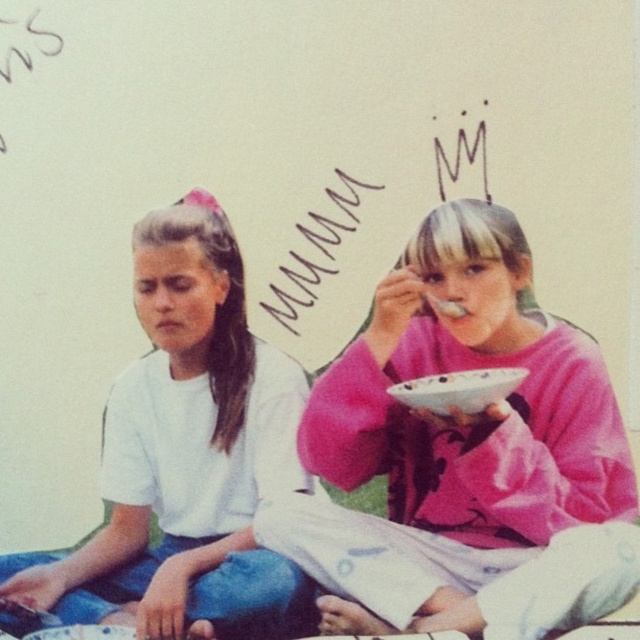
Question: Considering the relative positions of pink matte sweater at upper right and handwritten text at upper center in the image provided, where is pink matte sweater at upper right located with respect to handwritten text at upper center?

Choices:
 (A) left
 (B) right

Answer: (B)

Question: Does pink matte sweater at upper right lie in front of handwritten text at upper center?

Choices:
 (A) no
 (B) yes

Answer: (B)

Question: Which point is farther to the camera?

Choices:
 (A) pink matte sweater at upper right
 (B) white matte shirt at left
 (C) handwritten text at upper center

Answer: (C)

Question: Which is farther from the pink matte sweater at upper right?

Choices:
 (A) white matte shirt at left
 (B) handwritten text at upper center

Answer: (A)

Question: Which of the following is the farthest from the observer?

Choices:
 (A) pink matte sweater at upper right
 (B) white matte shirt at left
 (C) handwritten text at upper center

Answer: (C)

Question: Is pink matte sweater at upper right thinner than handwritten text at upper center?

Choices:
 (A) no
 (B) yes

Answer: (A)